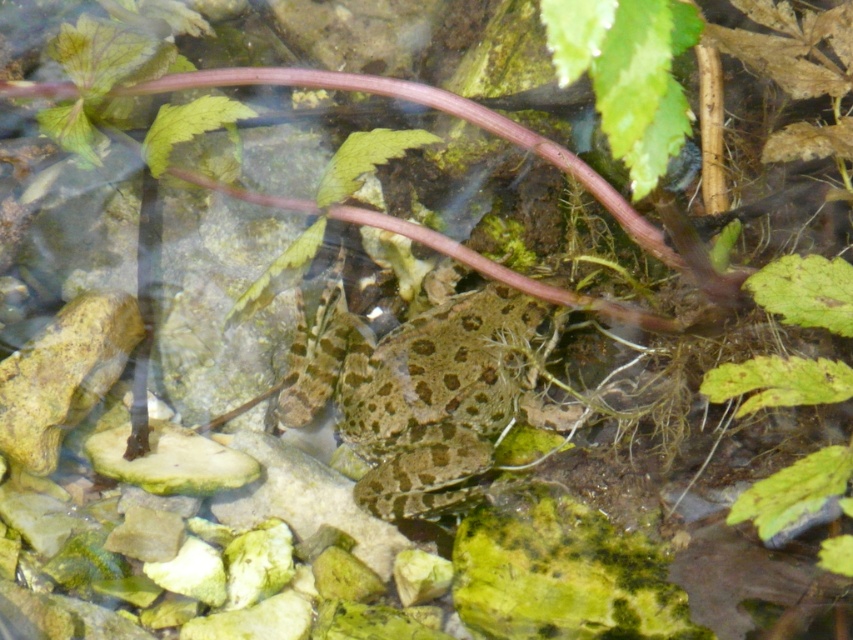
You are standing at the edge of a pond and see the speckled skin frog at center. If your eyes are at 5 feet above the water surface, can you see the frog clearly?

The speckled skin frog at center and viewer are 4.86 feet apart from each other, so yes, you can see the frog clearly because the distance is less than 5 feet.

Based on the scene description, which object is larger in size between the speckled skin frog at center and the green leafy plant at lower right?

The speckled skin frog at center is bigger than the green leafy plant at lower right according to the description.